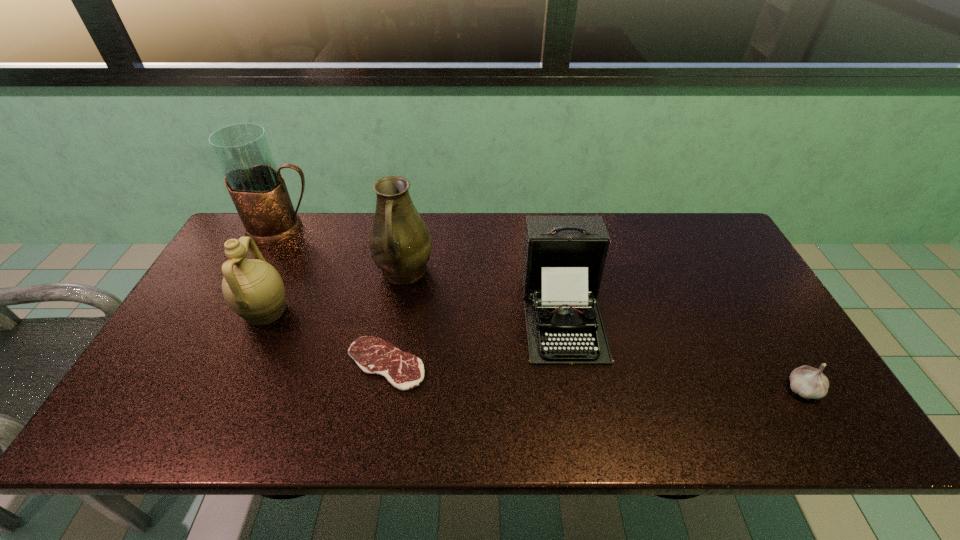
The height and width of the screenshot is (540, 960). Identify the location of pitcher that is the closest to the second object from right to left. (400, 243).

Where is `pitcher identified as the third closest to the steak`? pitcher identified as the third closest to the steak is located at coordinates (257, 188).

This screenshot has height=540, width=960. I want to click on vacant region that satisfies the following two spatial constraints: 1. with the handle on the side of the farthest pitcher; 2. on the right side of the shortest pitcher, so click(241, 312).

What are the coordinates of `vacant region that satisfies the following two spatial constraints: 1. inside the open case of the fifth tallest object; 2. on the right side of the typewriter` in the screenshot? It's located at (575, 389).

You are a GUI agent. You are given a task and a screenshot of the screen. Output one action in this format:
    pyautogui.click(x=<x>, y=<y>)
    Task: Click on the free location that satisfies the following two spatial constraints: 1. with the handle on the side of the farthest object; 2. on the right side of the shortest pitcher
    The height and width of the screenshot is (540, 960).
    Given the screenshot: What is the action you would take?
    pyautogui.click(x=241, y=312)